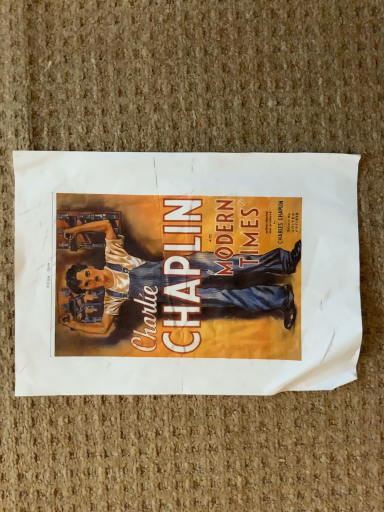
Locate an element on the screen. This screenshot has width=384, height=512. free space above matte paper poster at center (from a real-world perspective) is located at coordinates click(186, 261).